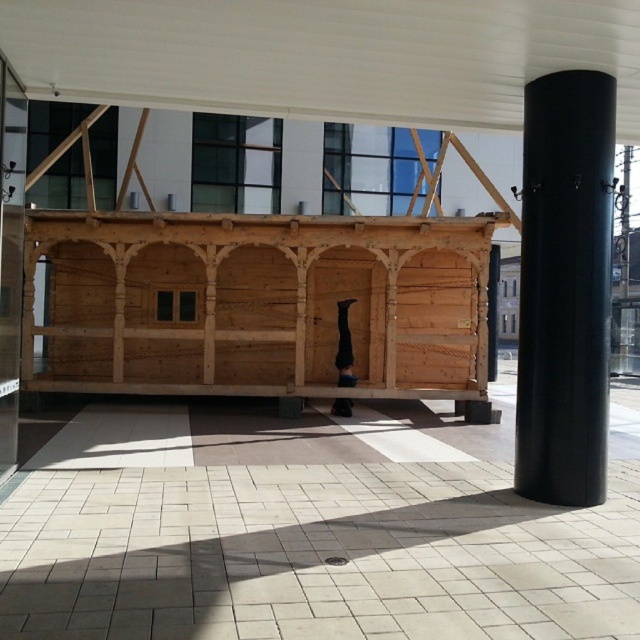
You are a visitor in the mall and want to take a photo of the natural wood log cabin at center and the white matte canopy at upper center. Which object is taller in the image?

The natural wood log cabin at center is taller than the white matte canopy at upper center.

You are standing in front of the wooden cabin with two points marked on its structure. Which point, point (161,339) or point (288,8), is closer to you?

Point (161,339) is closer to you because it is further to the viewer than point (288,8).